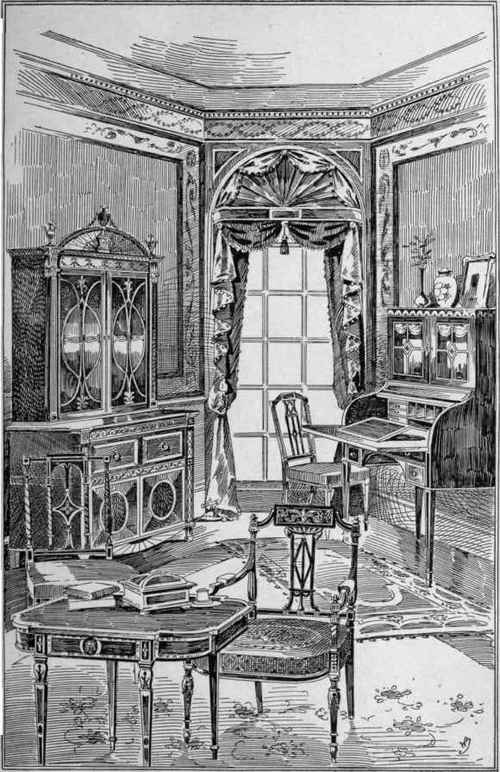
Find the location of `drawers`. drawers is located at coordinates (130, 458), (162, 451).